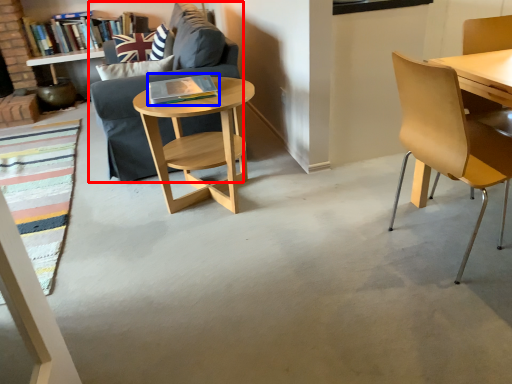
Question: Which point is further to the camera, studio couch (highlighted by a red box) or book (highlighted by a blue box)?

Choices:
 (A) studio couch
 (B) book

Answer: (A)